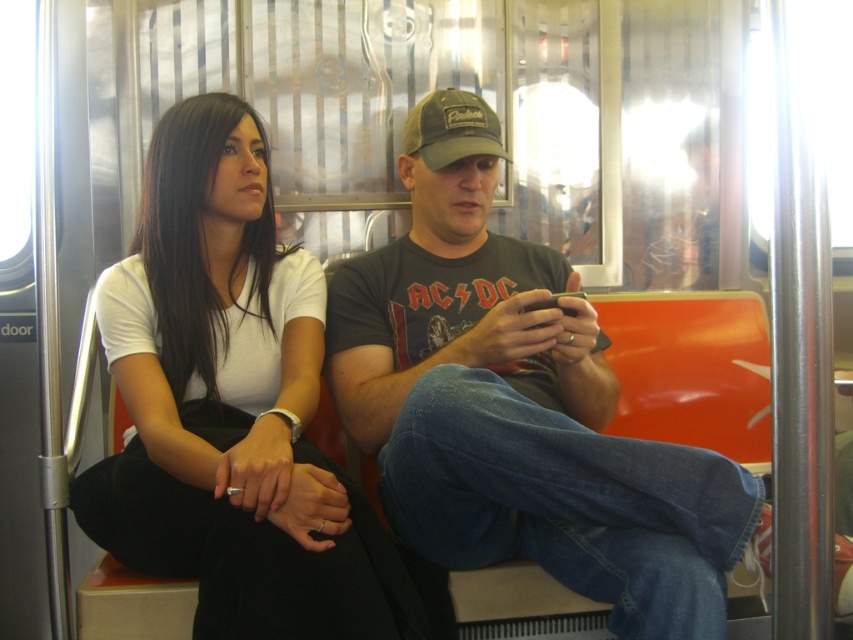
Question: Which point appears closest to the camera in this image?

Choices:
 (A) (453, 212)
 (B) (305, 413)

Answer: (B)

Question: Observing the image, what is the correct spatial positioning of dark gray t-shirt at center in reference to white matte shirt at upper left?

Choices:
 (A) above
 (B) below

Answer: (B)

Question: Which point appears farthest from the camera in this image?

Choices:
 (A) (368, 371)
 (B) (213, 342)

Answer: (A)

Question: Is dark gray t-shirt at center closer to camera compared to white matte shirt at upper left?

Choices:
 (A) no
 (B) yes

Answer: (B)

Question: Is dark gray t-shirt at center bigger than white matte shirt at upper left?

Choices:
 (A) no
 (B) yes

Answer: (B)